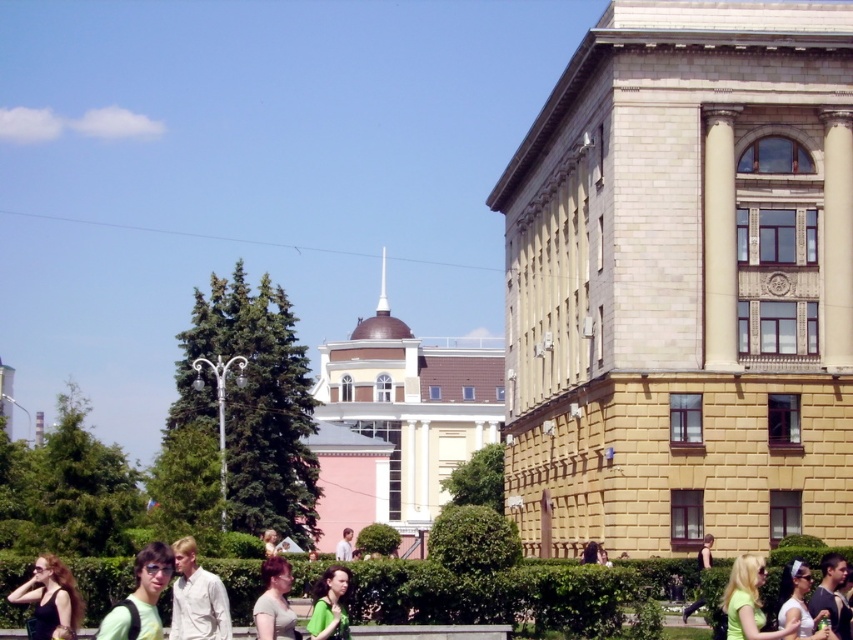
Question: Estimate the real-world distances between objects in this image. Which object is closer to the matte black dress at lower left?

Choices:
 (A) light beige shirt at lower left
 (B) light green fabric shirt at lower right

Answer: (A)

Question: Is the position of matte black dress at lower left less distant than that of green fabric shirt at center?

Choices:
 (A) no
 (B) yes

Answer: (B)

Question: Which of these objects is positioned closest to the light green fabric shirt at lower right?

Choices:
 (A) matte black dress at lower left
 (B) green leafy hedge at center
 (C) green matte shirt at lower left

Answer: (B)

Question: Does light green fabric shirt at lower right appear under light brown hair at center?

Choices:
 (A) no
 (B) yes

Answer: (B)

Question: Can you confirm if light beige shirt at lower left is bigger than green matte shirt at center?

Choices:
 (A) yes
 (B) no

Answer: (B)

Question: Which point is farther to the camera?

Choices:
 (A) light green fabric shirt at lower right
 (B) light beige shirt at lower left
 (C) light brown hair at center

Answer: (B)